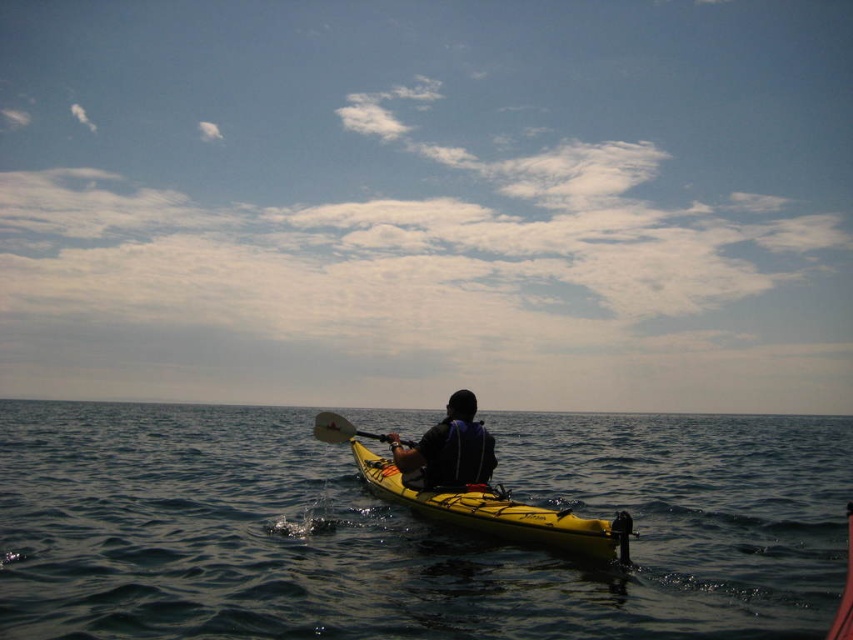
Can you confirm if dark blue water at center is positioned below yellow matte kayak at center?

Indeed, dark blue water at center is positioned under yellow matte kayak at center.

Locate an element on the screen. dark blue water at center is located at coordinates (409, 529).

Is dark blue water at center positioned at the back of yellow matte paddle at center?

No, dark blue water at center is in front of yellow matte paddle at center.

Does point (669, 452) come farther from viewer compared to point (325, 440)?

Yes.

The width and height of the screenshot is (853, 640). I want to click on dark blue water at center, so click(409, 529).

Can you confirm if dark blue fabric jacket at center is bigger than yellow matte paddle at center?

No.

Does point (393, 436) come behind point (335, 433)?

That is False.

Find the location of a particular element. dark blue fabric jacket at center is located at coordinates (448, 449).